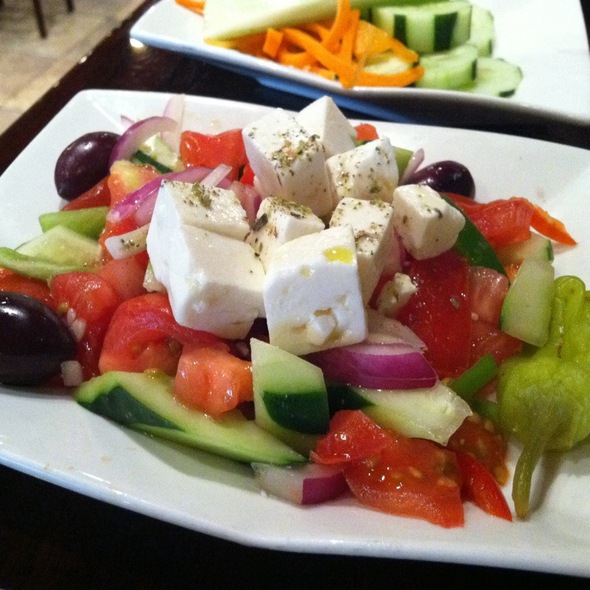
The height and width of the screenshot is (590, 590). Find the location of `white plate`. white plate is located at coordinates (178, 519).